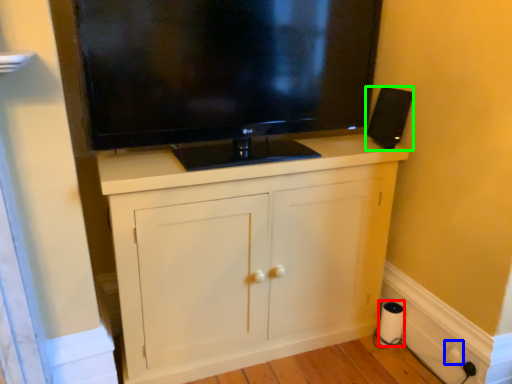
Question: Which object is the farthest from paper towel (highlighted by a red box)? Choose among these: electric outlet (highlighted by a blue box) or loudspeaker (highlighted by a green box).

Choices:
 (A) electric outlet
 (B) loudspeaker

Answer: (B)